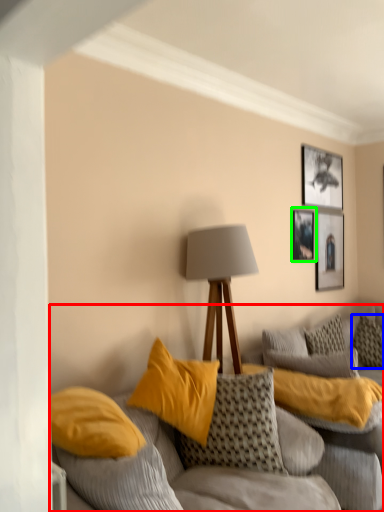
Question: Based on their relative distances, which object is nearer to studio couch (highlighted by a red box)? Choose from pillow (highlighted by a blue box) and picture frame (highlighted by a green box).

Choices:
 (A) pillow
 (B) picture frame

Answer: (A)